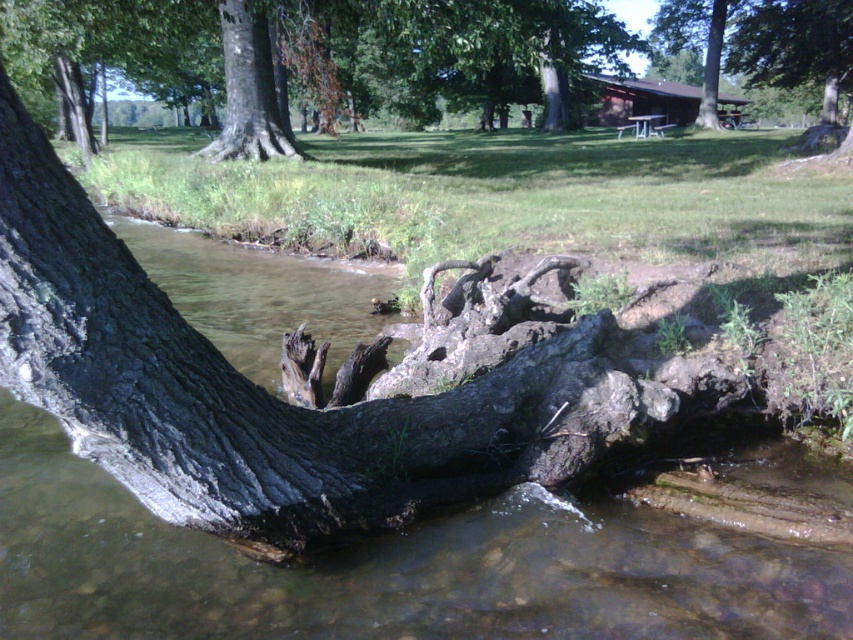
Does smooth bark tree at upper center have a larger size compared to brown wooden cabin at upper center?

Indeed, smooth bark tree at upper center has a larger size compared to brown wooden cabin at upper center.

Between point (813, 77) and point (602, 83), which one is positioned in front?

Point (813, 77) is in front.

At what (x,y) coordinates should I click in order to perform the action: click on smooth bark tree at upper center. Please return your answer as a coordinate pair (x, y). Image resolution: width=853 pixels, height=640 pixels. Looking at the image, I should click on pos(793,48).

Is point (781, 35) less distant than point (265, 140)?

No, (781, 35) is further to viewer.

Which is above, smooth bark tree at upper center or smooth bark tree trunk at upper center?

smooth bark tree at upper center is above.

What do you see at coordinates (793, 48) in the screenshot? Image resolution: width=853 pixels, height=640 pixels. I see `smooth bark tree at upper center` at bounding box center [793, 48].

Find the location of a particular element. smooth bark tree at upper center is located at coordinates (793, 48).

Can you confirm if dark gray bark tree trunk at left is smaller than brown wooden cabin at upper center?

Incorrect, dark gray bark tree trunk at left is not smaller in size than brown wooden cabin at upper center.

Between dark gray bark tree trunk at left and brown wooden cabin at upper center, which one appears on the left side from the viewer's perspective?

dark gray bark tree trunk at left is more to the left.

Locate an element on the screen. Image resolution: width=853 pixels, height=640 pixels. dark gray bark tree trunk at left is located at coordinates (328, 51).

Where is `dark gray bark tree trunk at left`? dark gray bark tree trunk at left is located at coordinates (328, 51).